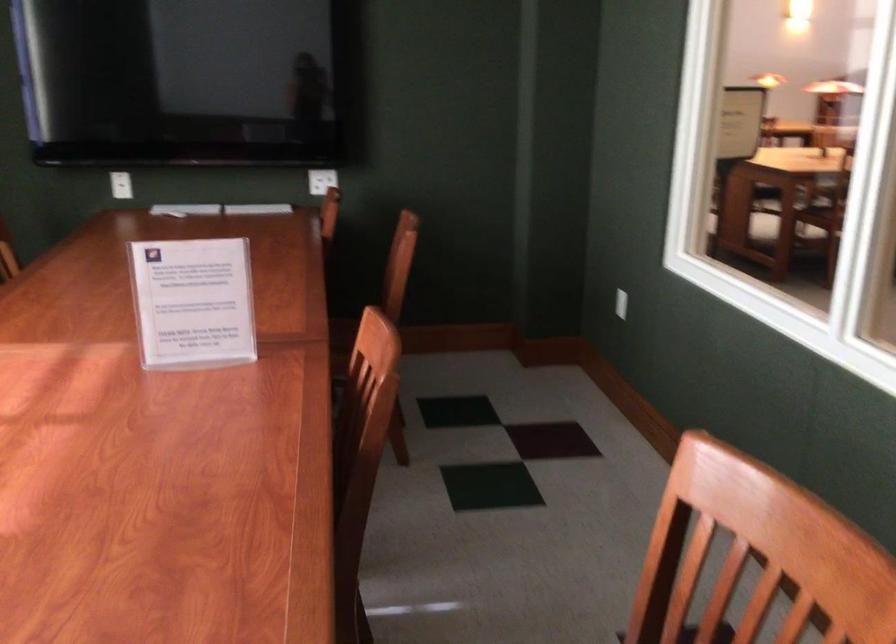
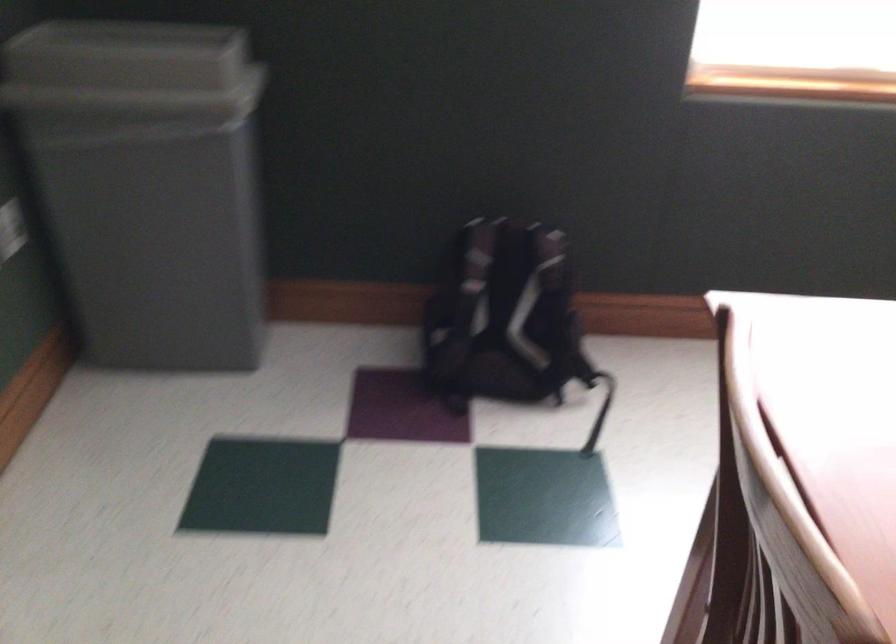
How did the camera likely rotate?

The camera rotated toward left-down.